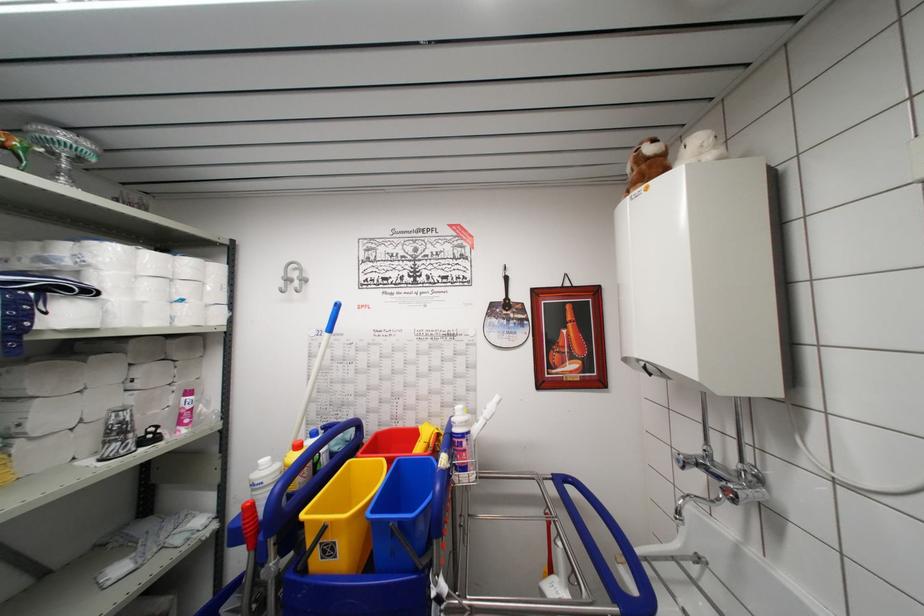
Which object does [62,148] point to?

This point indicates the silver decorative bowl.